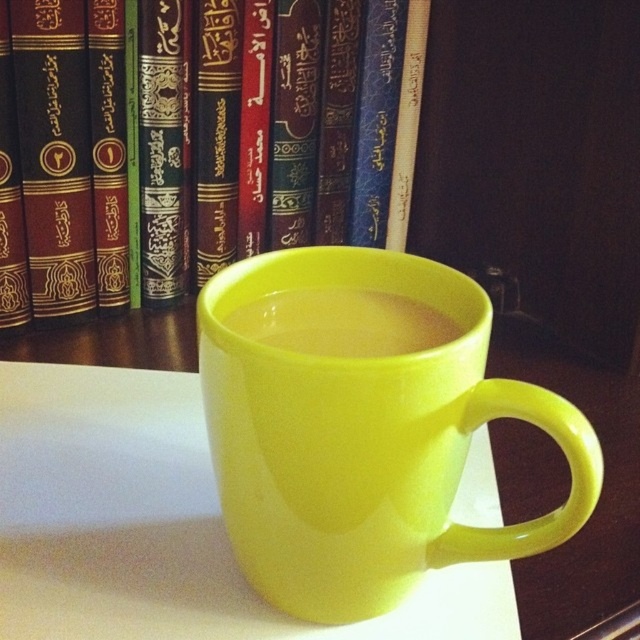
You have a glossy ceramic mug at center and a translucent plastic liquid at center. Which one has a greater width?

The glossy ceramic mug at center has a greater width than the translucent plastic liquid at center.

You are a librarian who needs to place a new book on the shelf. You have a glossy ceramic mug at center and a matte black book at center in your hand. Which object should you place first to ensure proper arrangement?

You should place the matte black book at center first because the glossy ceramic mug at center is behind it, so placing the book first allows the mug to be positioned behind it correctly.

You are trying to decide whether to place a small candle on the table next to the glossy ceramic mug at center. Based on the height of the matte black book at center, do you think the candle will be visible over it if placed there?

The matte black book at center is much taller than the glossy ceramic mug at center, so placing the candle next to the mug might still allow it to be visible over the book since the book is taller but the candle could be positioned higher.